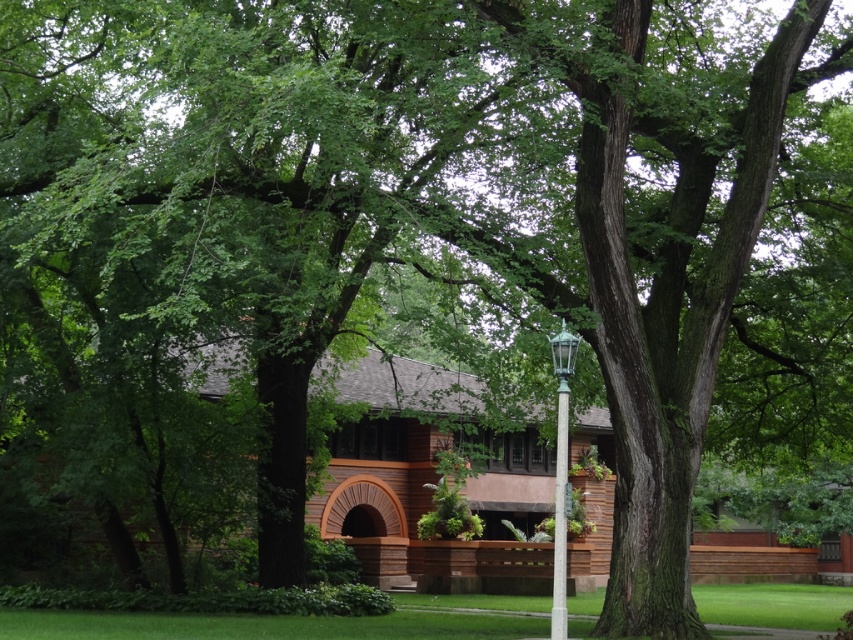
Who is higher up, green glass lamp post at center or green glass pole at center?

green glass pole at center is higher up.

Is green glass lamp post at center positioned at the back of green glass pole at center?

No, green glass lamp post at center is in front of green glass pole at center.

Does point (566, 637) come behind point (561, 390)?

That is False.

Where is `green glass lamp post at center`? green glass lamp post at center is located at coordinates (561, 476).

Does green grass at lower center have a lesser width compared to green glass lamp post at center?

In fact, green grass at lower center might be wider than green glass lamp post at center.

Who is more distant from viewer, (782,584) or (566,336)?

Point (782,584)

Identify the location of green grass at lower center. (299, 621).

Does green grass at lower center have a lesser width compared to green glass pole at center?

Incorrect, green grass at lower center's width is not less than green glass pole at center's.

Which is more to the right, green grass at lower center or green glass pole at center?

Positioned to the right is green grass at lower center.

You are a GUI agent. You are given a task and a screenshot of the screen. Output one action in this format:
    pyautogui.click(x=<x>, y=<y>)
    Task: Click on the green grass at lower center
    This screenshot has height=640, width=853.
    Given the screenshot: What is the action you would take?
    pyautogui.click(x=299, y=621)

The image size is (853, 640). Identify the location of green grass at lower center. (299, 621).